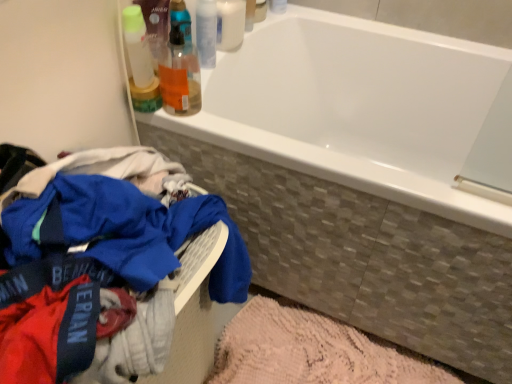
Describe the element at coordinates (356, 107) in the screenshot. I see `white glossy bathtub at upper center` at that location.

Find the location of a particular element. The height and width of the screenshot is (384, 512). white glossy bathtub at upper center is located at coordinates (356, 107).

From the image's perspective, which one is positioned lower, white glossy bottle at upper center, placed as the 1th toiletry when sorted from top to bottom, or blue cotton clothes at lower left?

blue cotton clothes at lower left, from the image's perspective.

Looking at this image, is white glossy bottle at upper center, placed as the 1th toiletry when sorted from top to bottom, further to camera compared to blue cotton clothes at lower left?

Yes, it is.

Is point (221, 12) closer to camera compared to point (3, 306)?

No, (221, 12) is further to viewer.

What's the angular difference between white glossy bottle at upper center, placed as the 1th toiletry when sorted from top to bottom, and blue cotton clothes at lower left's facing directions?

0.277 degrees.

Is white glossy bottle at upper center, arranged as the 3th toiletry when ordered from the bottom, aimed at white glossy bottle at upper center, the second toiletry viewed from the top?

No, white glossy bottle at upper center, arranged as the 3th toiletry when ordered from the bottom, is not aimed at white glossy bottle at upper center, the second toiletry viewed from the top.

From the image's perspective, is white glossy bottle at upper center, placed as the 1th toiletry when sorted from top to bottom, positioned above or below white glossy bottle at upper center, placed as the 2th toiletry when sorted from bottom to top?

Clearly, from the image's perspective, white glossy bottle at upper center, placed as the 1th toiletry when sorted from top to bottom, is above white glossy bottle at upper center, placed as the 2th toiletry when sorted from bottom to top.

Considering the sizes of white glossy bottle at upper center, arranged as the 3th toiletry when ordered from the bottom, and white glossy bottle at upper center, the second toiletry viewed from the top, in the image, is white glossy bottle at upper center, arranged as the 3th toiletry when ordered from the bottom, taller or shorter than white glossy bottle at upper center, the second toiletry viewed from the top,?

Clearly, white glossy bottle at upper center, arranged as the 3th toiletry when ordered from the bottom, is taller compared to white glossy bottle at upper center, the second toiletry viewed from the top.

Between point (238, 27) and point (209, 8), which one is positioned behind?

The point (238, 27) is farther.

Which is more to the left, blue cotton clothes at lower left or white glossy bottle at upper center, arranged as the 3th toiletry when ordered from the bottom?

blue cotton clothes at lower left is more to the left.

Is blue cotton clothes at lower left oriented away from white glossy bottle at upper center, placed as the 1th toiletry when sorted from top to bottom?

blue cotton clothes at lower left is not turned away from white glossy bottle at upper center, placed as the 1th toiletry when sorted from top to bottom.

Considering the relative sizes of blue cotton clothes at lower left and white glossy bottle at upper center, placed as the 1th toiletry when sorted from top to bottom, in the image provided, is blue cotton clothes at lower left thinner than white glossy bottle at upper center, placed as the 1th toiletry when sorted from top to bottom,?

In fact, blue cotton clothes at lower left might be wider than white glossy bottle at upper center, placed as the 1th toiletry when sorted from top to bottom.

Looking at this image, does blue cotton clothes at lower left come behind white glossy bottle at upper center, placed as the 1th toiletry when sorted from top to bottom?

No, the depth of blue cotton clothes at lower left is less than that of white glossy bottle at upper center, placed as the 1th toiletry when sorted from top to bottom.

The image size is (512, 384). I want to click on bathtub to the right of translucent plastic bottles at upper left, which is the 3th toiletry from top to bottom, so click(356, 107).

Does point (344, 130) come in front of point (169, 36)?

No, (344, 130) is further to viewer.

Looking at this image, from a real-world perspective, relative to translucent plastic bottles at upper left, which is the first toiletry from bottom to top, is white glossy bathtub at upper center vertically above or below?

In terms of real-world spatial position, white glossy bathtub at upper center is below translucent plastic bottles at upper left, which is the first toiletry from bottom to top.

Does white glossy bathtub at upper center have a smaller size compared to translucent plastic bottles at upper left, which is the first toiletry from bottom to top?

Incorrect, white glossy bathtub at upper center is not smaller in size than translucent plastic bottles at upper left, which is the first toiletry from bottom to top.

Is white glossy bathtub at upper center smaller than white glossy bottle at upper center, placed as the 2th toiletry when sorted from bottom to top?

Incorrect, white glossy bathtub at upper center is not smaller in size than white glossy bottle at upper center, placed as the 2th toiletry when sorted from bottom to top.

Would you consider white glossy bathtub at upper center to be distant from white glossy bottle at upper center, placed as the 2th toiletry when sorted from bottom to top?

Actually, white glossy bathtub at upper center and white glossy bottle at upper center, placed as the 2th toiletry when sorted from bottom to top, are a little close together.

From the image's perspective, count 2nd toiletrys upward from the white glossy bathtub at upper center and point to it. Please provide its 2D coordinates.

[(206, 32)]

Does point (340, 61) come closer to viewer compared to point (207, 61)?

No, it is behind (207, 61).

Is blue cotton clothes at lower left not inside white glossy bathtub at upper center?

Indeed, blue cotton clothes at lower left is completely outside white glossy bathtub at upper center.

From a real-world perspective, which object stands above the other?

In real-world perspective, blue cotton clothes at lower left is above.

Is blue cotton clothes at lower left placed right next to white glossy bathtub at upper center?

blue cotton clothes at lower left is not next to white glossy bathtub at upper center, and they're not touching.

Considering the positions of point (66, 267) and point (401, 95), is point (66, 267) closer or farther from the camera than point (401, 95)?

Point (66, 267) appears to be closer to the viewer than point (401, 95).

Is white glossy bathtub at upper center taller or shorter than white glossy bottle at upper center, arranged as the 3th toiletry when ordered from the bottom?

Clearly, white glossy bathtub at upper center is taller compared to white glossy bottle at upper center, arranged as the 3th toiletry when ordered from the bottom.

Does point (221, 55) come closer to viewer compared to point (218, 30)?

No, (221, 55) is further to viewer.

Considering the sizes of white glossy bathtub at upper center and white glossy bottle at upper center, arranged as the 3th toiletry when ordered from the bottom, in the image, is white glossy bathtub at upper center bigger or smaller than white glossy bottle at upper center, arranged as the 3th toiletry when ordered from the bottom,?

In the image, white glossy bathtub at upper center appears to be larger than white glossy bottle at upper center, arranged as the 3th toiletry when ordered from the bottom.

Is there a large distance between white glossy bathtub at upper center and white glossy bottle at upper center, arranged as the 3th toiletry when ordered from the bottom?

That's not correct — white glossy bathtub at upper center is a little close to white glossy bottle at upper center, arranged as the 3th toiletry when ordered from the bottom.

Locate an element on the screen. the 3rd toiletry above when counting from the blue cotton clothes at lower left (from the image's perspective) is located at coordinates (230, 24).

Where is `toiletry located on the right of white glossy bottle at upper center, the second toiletry viewed from the top`? toiletry located on the right of white glossy bottle at upper center, the second toiletry viewed from the top is located at coordinates (230, 24).

Which object lies nearer to the anchor point pink textured bath mat at lower center, blue cotton clothes at lower left or white glossy bottle at upper center, placed as the 1th toiletry when sorted from top to bottom?

The object closer to pink textured bath mat at lower center is blue cotton clothes at lower left.

Estimate the real-world distances between objects in this image. Which object is further from white glossy bottle at upper center, placed as the 2th toiletry when sorted from bottom to top, translucent plastic bottles at upper left, which is the first toiletry from bottom to top, or pink textured bath mat at lower center?

pink textured bath mat at lower center is further to white glossy bottle at upper center, placed as the 2th toiletry when sorted from bottom to top.

Estimate the real-world distances between objects in this image. Which object is further from translucent plastic bottles at upper left, which is the 3th toiletry from top to bottom, white glossy bottle at upper center, arranged as the 3th toiletry when ordered from the bottom, or pink textured bath mat at lower center?

pink textured bath mat at lower center is positioned further to the anchor translucent plastic bottles at upper left, which is the 3th toiletry from top to bottom.

Estimate the real-world distances between objects in this image. Which object is closer to white glossy bottle at upper center, arranged as the 3th toiletry when ordered from the bottom, pink textured bath mat at lower center or white glossy bathtub at upper center?

Among the two, white glossy bathtub at upper center is located nearer to white glossy bottle at upper center, arranged as the 3th toiletry when ordered from the bottom.

Looking at the image, which one is located further to white glossy bathtub at upper center, white glossy bottle at upper center, arranged as the 3th toiletry when ordered from the bottom, or blue cotton clothes at lower left?

Among the two, blue cotton clothes at lower left is located further to white glossy bathtub at upper center.

From the image, which object appears to be nearer to pink textured bath mat at lower center, white glossy bottle at upper center, arranged as the 3th toiletry when ordered from the bottom, or white glossy bathtub at upper center?

white glossy bathtub at upper center.

Considering their positions, is white glossy bottle at upper center, arranged as the 3th toiletry when ordered from the bottom, positioned closer to white glossy bottle at upper center, the second toiletry viewed from the top, than blue cotton clothes at lower left?

white glossy bottle at upper center, arranged as the 3th toiletry when ordered from the bottom, is closer to white glossy bottle at upper center, the second toiletry viewed from the top.

Estimate the real-world distances between objects in this image. Which object is closer to blue cotton clothes at lower left, white glossy bottle at upper center, the second toiletry viewed from the top, or white glossy bathtub at upper center?

The object closer to blue cotton clothes at lower left is white glossy bathtub at upper center.

This screenshot has width=512, height=384. What are the coordinates of `clothing that lies between translucent plastic bottles at upper left, which is the first toiletry from bottom to top, and pink textured bath mat at lower center from top to bottom` in the screenshot? It's located at (100, 267).

At what (x,y) coordinates should I click in order to perform the action: click on clothing between white glossy bottle at upper center, arranged as the 3th toiletry when ordered from the bottom, and pink textured bath mat at lower center vertically. Please return your answer as a coordinate pair (x, y). This screenshot has width=512, height=384. Looking at the image, I should click on (100, 267).

Where is `bathtub that lies between white glossy bottle at upper center, placed as the 1th toiletry when sorted from top to bottom, and pink textured bath mat at lower center from top to bottom`? This screenshot has width=512, height=384. bathtub that lies between white glossy bottle at upper center, placed as the 1th toiletry when sorted from top to bottom, and pink textured bath mat at lower center from top to bottom is located at coordinates (356, 107).

Image resolution: width=512 pixels, height=384 pixels. What are the coordinates of `toiletry between white glossy bottle at upper center, the second toiletry viewed from the top, and pink textured bath mat at lower center from top to bottom` in the screenshot? It's located at (180, 75).